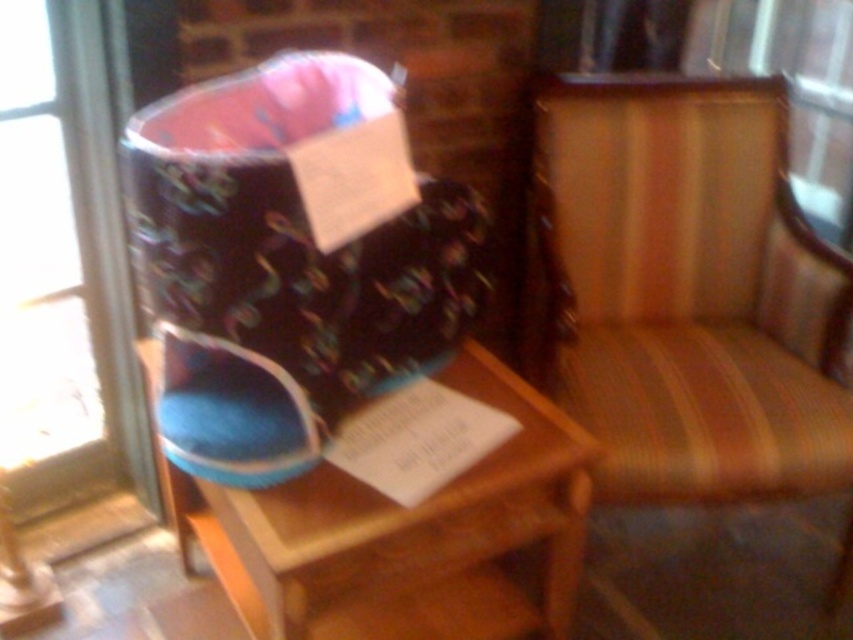
Please describe the exact 2D coordinates of the velvet fabric boot at center in the image.

The velvet fabric boot at center is located at the 2D coordinates of point (283,268).

You are a delivery robot standing 1.5 meters away from the camera. You need to deliver a package to the striped fabric armchair at center. Can you reach it without moving closer than 1 meter from the chair?

The striped fabric armchair at center is 1.18 meters away from the camera. Since you are 1.5 meters away from the camera, the distance between you and the chair is 1.5m minus 1.18m equals 0.32 meters. This means you are already 0.32 meters away from the chair, which is less than the 1 meter required. Therefore, you need to move back to ensure you are at least 1 meter away from the chair.